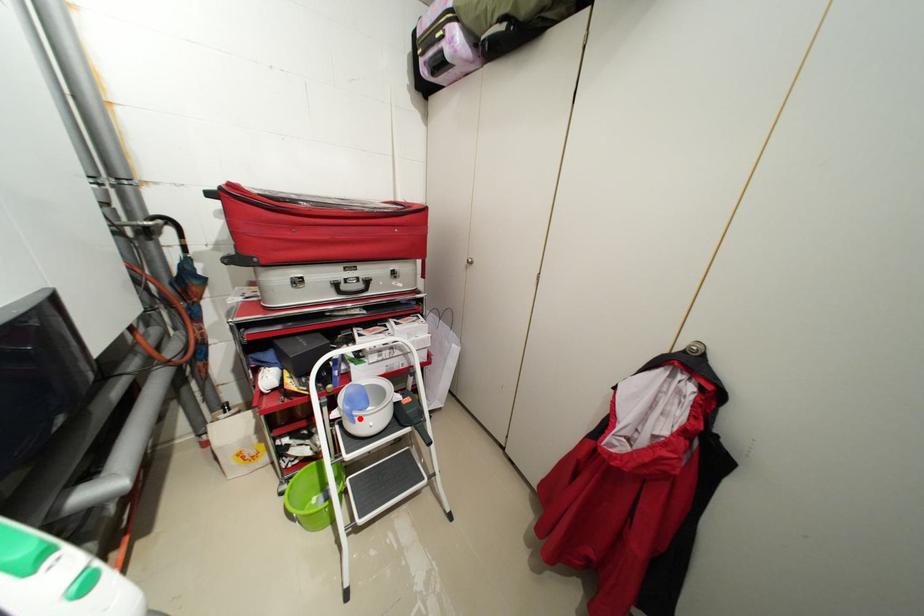
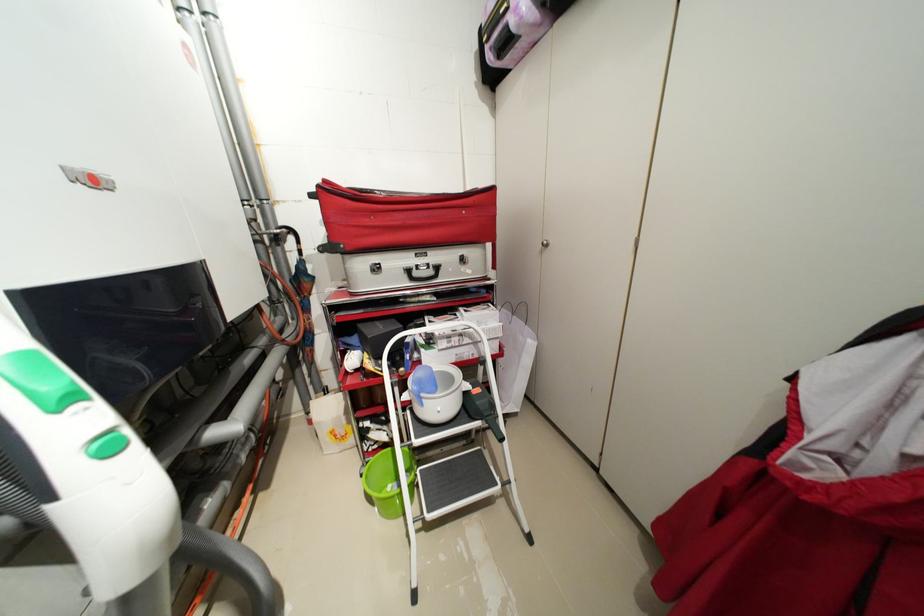
The point at the highlighted location is marked in the first image. Where is the corresponding point in the second image?

(428, 400)